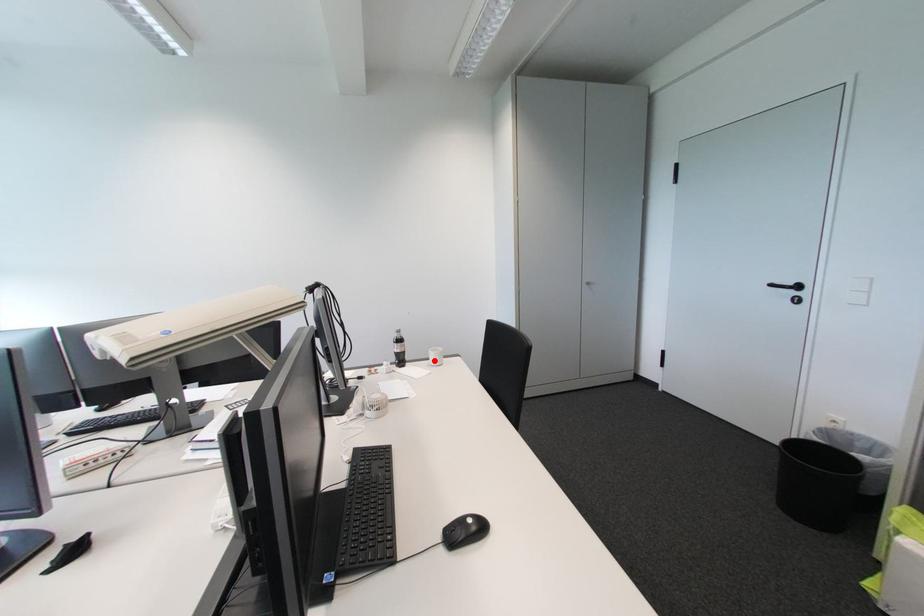
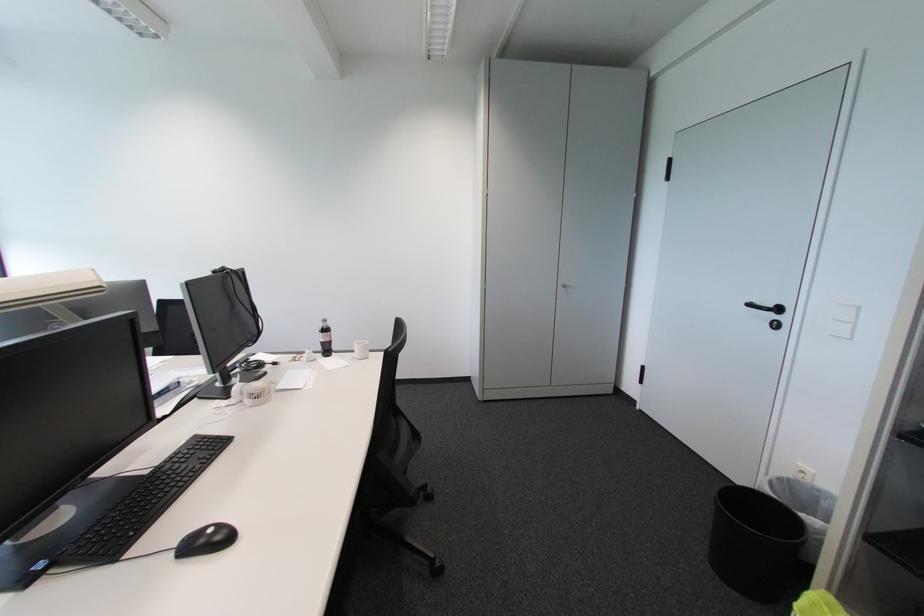
Question: I am providing you with two images of the same scene from different viewpoints. A red point is shown in image1. For the corresponding object point in image2, is it positioned nearer or farther from the camera?

Choices:
 (A) Nearer
 (B) Farther

Answer: (B)